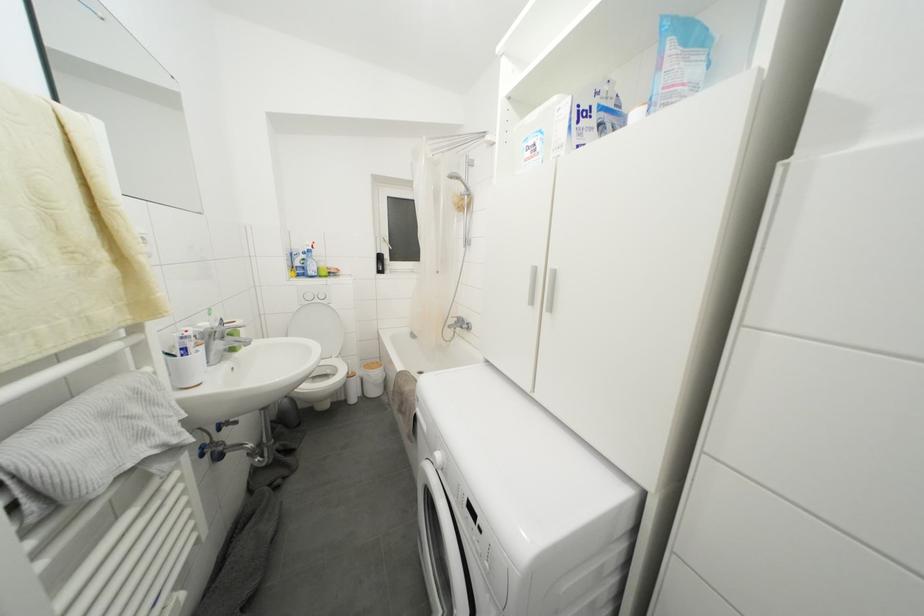
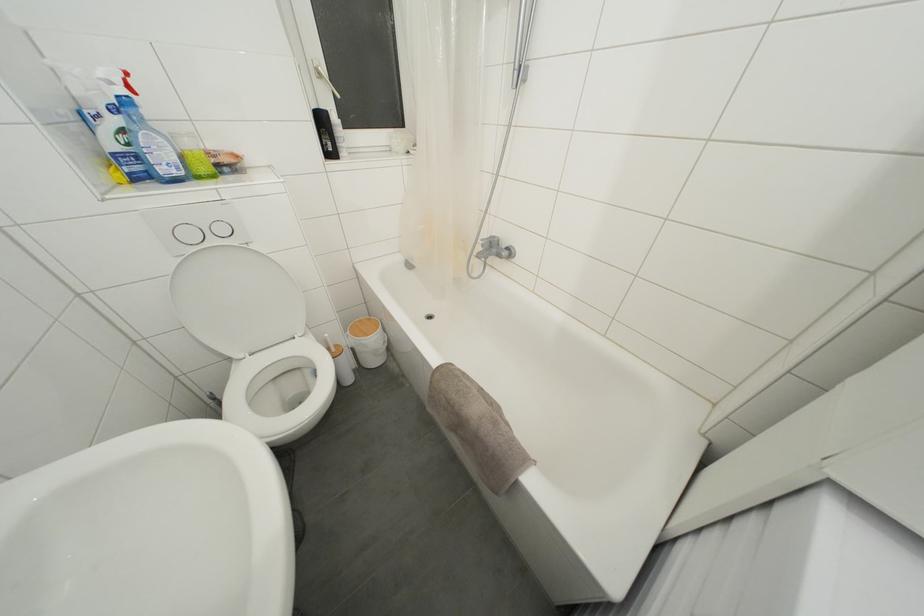
Find the pixel in the second image that matches point (383, 262) in the first image.

(325, 126)